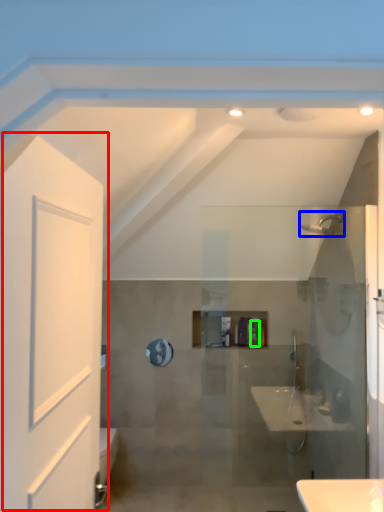
Question: Estimate the real-world distances between objects in this image. Which object is farther from door (highlighted by a red box), shower (highlighted by a blue box) or toiletry (highlighted by a green box)?

Choices:
 (A) shower
 (B) toiletry

Answer: (B)